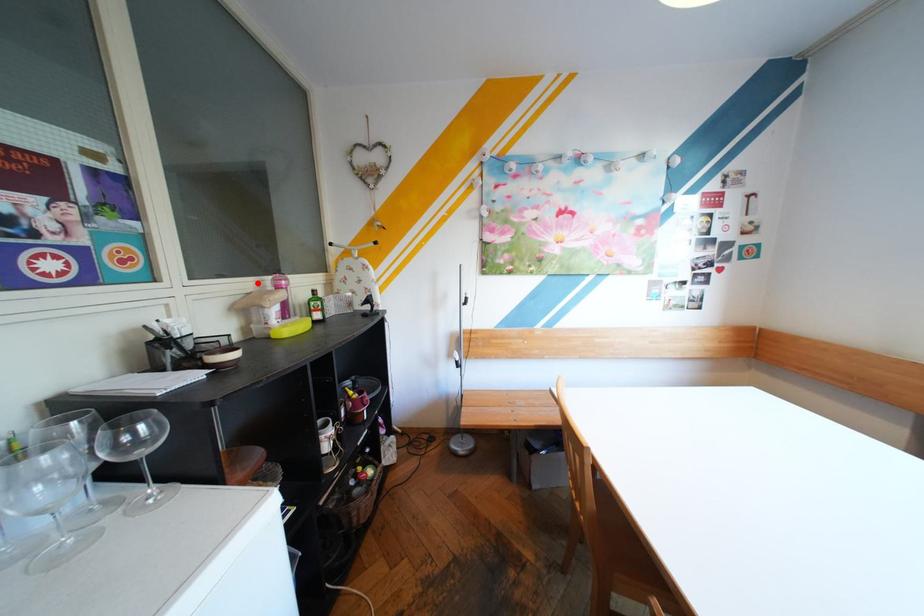
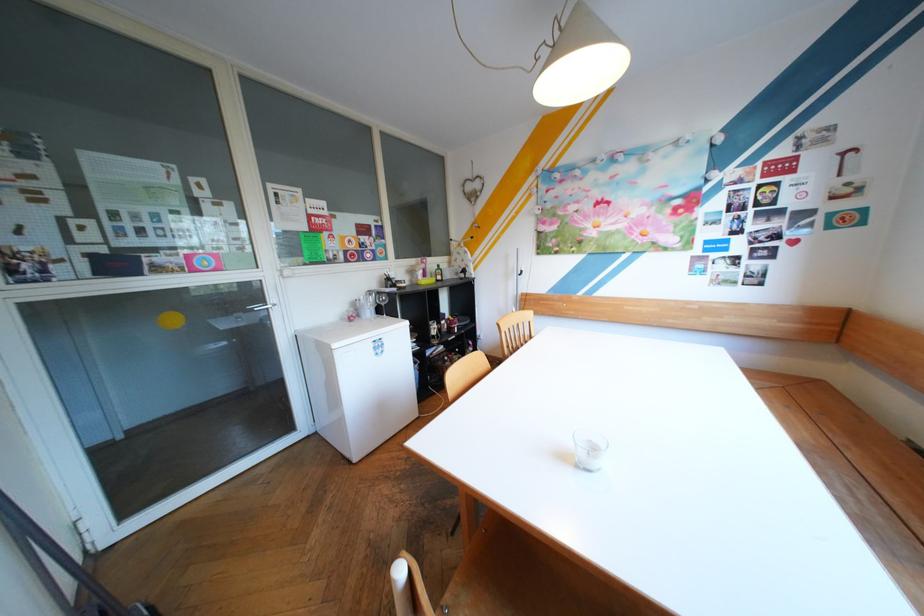
Question: I am providing you with two images of the same scene from different viewpoints. In image1, a red point is highlighted. Considering the same 3D point in image2, which of the following is correct?

Choices:
 (A) It is closer
 (B) It is farther

Answer: (A)